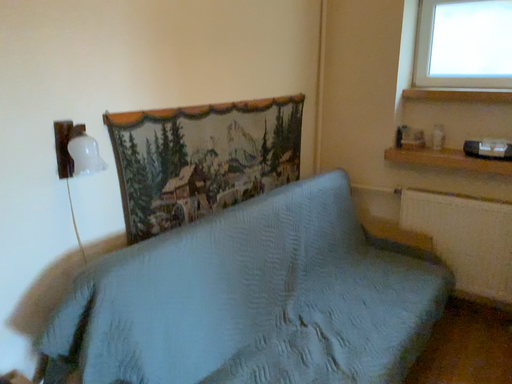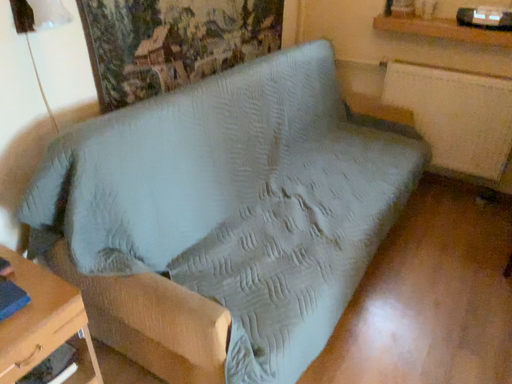
Question: Which way did the camera rotate in the video?

Choices:
 (A) rotated downward
 (B) rotated upward

Answer: (A)